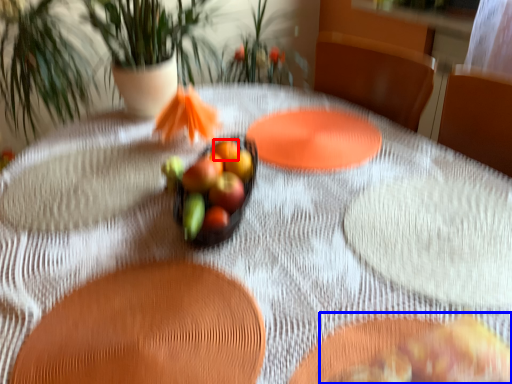
Question: Which of the following is the closest to the observer, fruit (highlighted by a red box) or food (highlighted by a blue box)?

Choices:
 (A) fruit
 (B) food

Answer: (B)